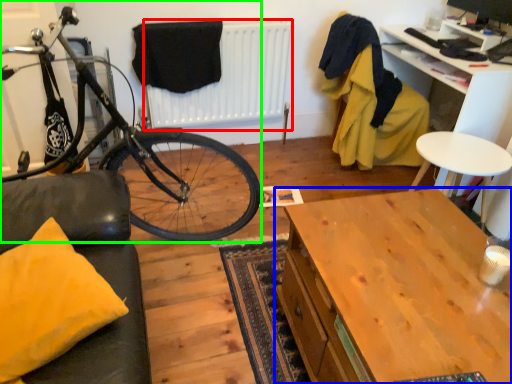
Question: Estimate the real-world distances between objects in this image. Which object is closer to radiator (highlighted by a red box), desk (highlighted by a blue box) or bicycle (highlighted by a green box)?

Choices:
 (A) desk
 (B) bicycle

Answer: (B)